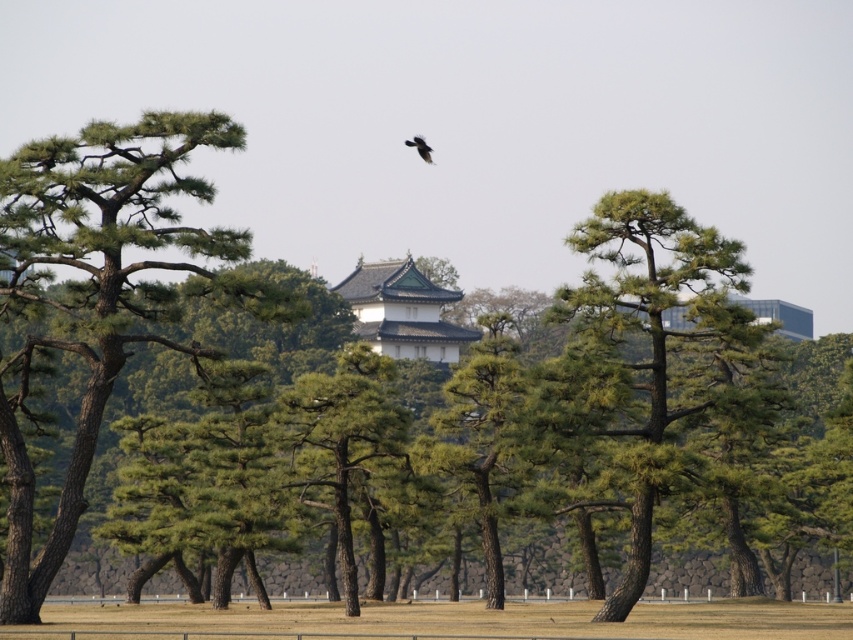
Find the location of a particular element. The height and width of the screenshot is (640, 853). green matte tree at left is located at coordinates click(x=102, y=291).

Is green matte tree at left in front of black matte bird at upper center?

That is True.

You are a GUI agent. You are given a task and a screenshot of the screen. Output one action in this format:
    pyautogui.click(x=<x>, y=<y>)
    Task: Click on the green matte tree at left
    
    Given the screenshot: What is the action you would take?
    pyautogui.click(x=102, y=291)

Who is positioned more to the left, green matte tree at center or black matte bird at upper center?

black matte bird at upper center

Is green matte tree at center behind black matte bird at upper center?

No.

Locate an element on the screen. The width and height of the screenshot is (853, 640). green matte tree at center is located at coordinates (648, 362).

Which is more to the right, green matte tree at left or green matte tree at center?

green matte tree at center is more to the right.

Consider the image. How distant is green matte tree at left from green matte tree at center?

green matte tree at left and green matte tree at center are 16.01 meters apart.

I want to click on green matte tree at left, so click(x=102, y=291).